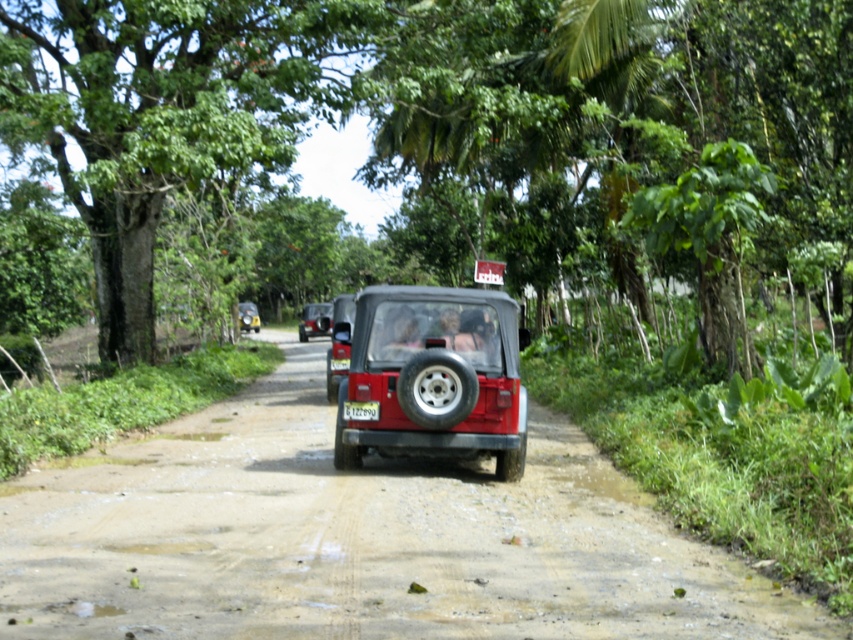
Between point (361, 410) and point (250, 323), which one is positioned in front?

Positioned in front is point (361, 410).

Between white plastic license plate at center and metallic silver car at center, which one is positioned lower?

Positioned lower is white plastic license plate at center.

Image resolution: width=853 pixels, height=640 pixels. What do you see at coordinates (360, 410) in the screenshot? I see `white plastic license plate at center` at bounding box center [360, 410].

Locate an element on the screen. The height and width of the screenshot is (640, 853). white plastic license plate at center is located at coordinates (360, 410).

In the scene shown: Does matte red jeep at center have a larger size compared to matte black jeep at center?

No.

Describe the element at coordinates (434, 376) in the screenshot. I see `matte red jeep at center` at that location.

Where is `matte red jeep at center`? Image resolution: width=853 pixels, height=640 pixels. matte red jeep at center is located at coordinates (434, 376).

Can you confirm if matte black jeep at center is shorter than white plastic license plate at center?

No.

Does matte black jeep at center appear over white plastic license plate at center?

Correct, matte black jeep at center is located above white plastic license plate at center.

Where is `matte black jeep at center`? This screenshot has width=853, height=640. matte black jeep at center is located at coordinates (312, 320).

Locate an element on the screen. The height and width of the screenshot is (640, 853). matte black jeep at center is located at coordinates (312, 320).